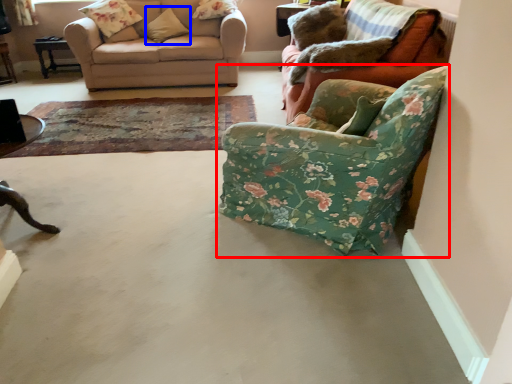
Question: Which object appears farthest to the camera in this image, chair (highlighted by a red box) or pillow (highlighted by a blue box)?

Choices:
 (A) chair
 (B) pillow

Answer: (B)